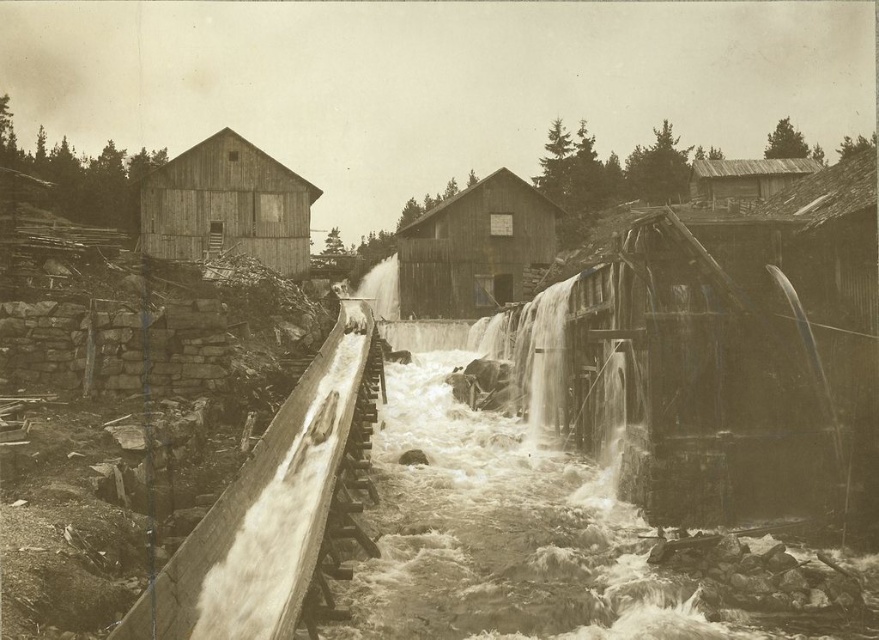
You are an engineer inspecting an old mill site. You notice a wooden hut at center and white frothy water at center. Which structure is higher in elevation?

The wooden hut at center is taller than the white frothy water at center, so the wooden hut at center is higher in elevation.

You are a surveyor tasked with identifying the location of a specific point in an industrial scene. The scene includes a large wooden building on the left and a smooth concrete waterfall at center. There is a point labeled as point [542,358]. Based on the provided coordinates, can you determine which object this point belongs to?

The point [542,358] is located on the smooth concrete waterfall at center.

You are standing at the point labeled as point (476,248) in the industrial scene. What type of structure are you currently positioned on?

You are standing on a wooden hut at center, as the point (476,248) is located on that structure.